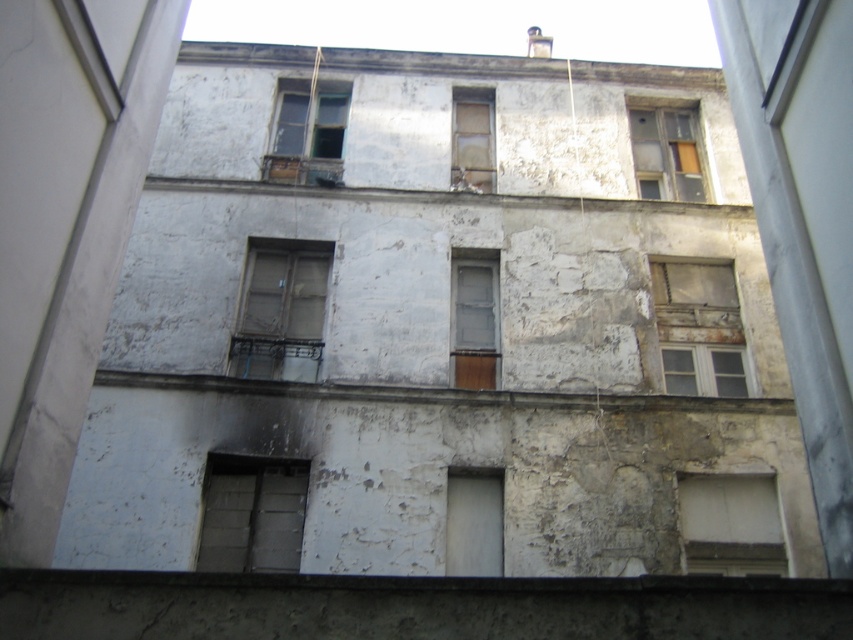
Is weathered wood window at upper right further to camera compared to white matte window at lower right?

Yes, it is behind white matte window at lower right.

Which is below, weathered wood window at upper right or white matte window at lower right?

white matte window at lower right is below.

Describe the element at coordinates (699, 328) in the screenshot. I see `weathered wood window at upper right` at that location.

Locate an element on the screen. weathered wood window at upper right is located at coordinates (699, 328).

Can you confirm if white matte window at lower right is thinner than white matte door at center?

Incorrect, white matte window at lower right's width is not less than white matte door at center's.

Can you confirm if white matte window at lower right is taller than white matte door at center?

No, white matte window at lower right is not taller than white matte door at center.

Where is `white matte window at lower right`? white matte window at lower right is located at coordinates (730, 524).

In order to click on white matte window at lower right in this screenshot , I will do point(730,524).

Does gray concrete window at center have a lesser width compared to matte gray window at center?

Incorrect, gray concrete window at center's width is not less than matte gray window at center's.

Can you confirm if gray concrete window at center is bigger than matte gray window at center?

No, gray concrete window at center is not bigger than matte gray window at center.

The image size is (853, 640). I want to click on gray concrete window at center, so click(252, 515).